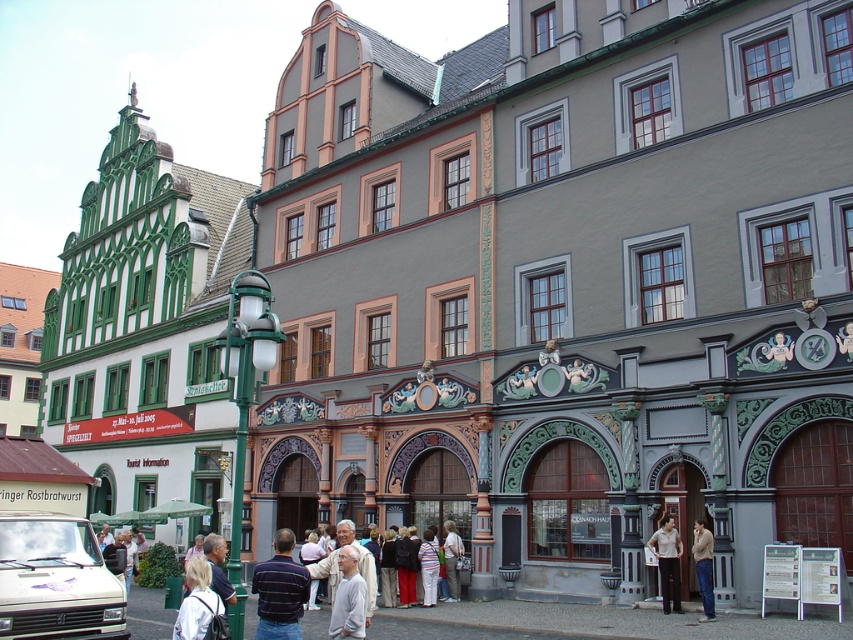
You are a photographer trying to capture a candid shot of the person wearing the white matte shirt at lower center and the person in denim jeans at lower right. Since you want to include both in the frame, can you determine if they are positioned side by side from left to right?

The white matte shirt at lower center is positioned on the left side of denim jeans at lower right, so yes, they are positioned side by side from left to right.